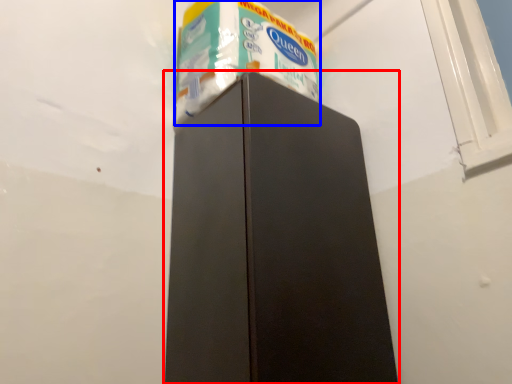
Question: Which of the following is the farthest to the observer, refrigerator (highlighted by a red box) or toilet paper (highlighted by a blue box)?

Choices:
 (A) refrigerator
 (B) toilet paper

Answer: (B)